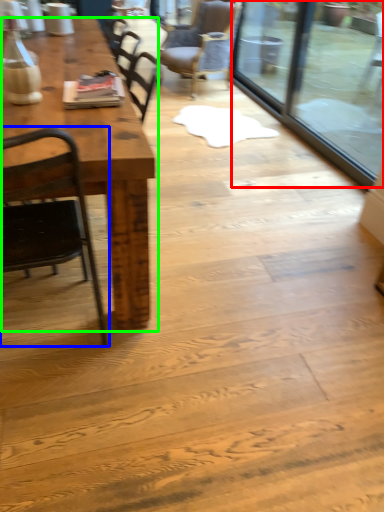
Question: Based on their relative distances, which object is farther from glass door (highlighted by a red box)? Choose from chair (highlighted by a blue box) and table (highlighted by a green box).

Choices:
 (A) chair
 (B) table

Answer: (A)